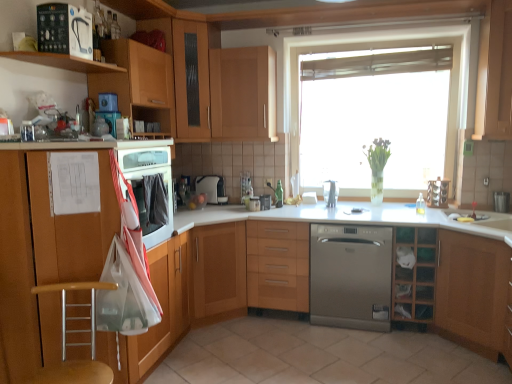
Where is `black plastic water filter at upper left, which ranks as the 2th kitchen appliance in back-to-front order`? This screenshot has height=384, width=512. black plastic water filter at upper left, which ranks as the 2th kitchen appliance in back-to-front order is located at coordinates (64, 30).

This screenshot has height=384, width=512. I want to click on metallic silver toaster at center, which is the second appliance in right-to-left order, so click(254, 204).

You are a GUI agent. You are given a task and a screenshot of the screen. Output one action in this format:
    pyautogui.click(x=<x>, y=<y>)
    Task: Click on the satin nickel faucet at center, the 1th appliance when ordered from right to left
    Image resolution: width=512 pixels, height=384 pixels.
    Given the screenshot: What is the action you would take?
    pyautogui.click(x=330, y=193)

Image resolution: width=512 pixels, height=384 pixels. What do you see at coordinates (414, 274) in the screenshot?
I see `wooden cabinet at lower right, the second shelf positioned from the top` at bounding box center [414, 274].

Measure the distance between light wood/wooden cabinet at center, which is counted as the sixth cabinetry, starting from the left, and camera.

light wood/wooden cabinet at center, which is counted as the sixth cabinetry, starting from the left, and camera are 3.18 meters apart from each other.

Describe the element at coordinates (350, 276) in the screenshot. I see `satin stainless steel dishwasher at lower center` at that location.

Where is `black plastic water filter at upper left, which appears as the 1th kitchen appliance when viewed from the front`? This screenshot has height=384, width=512. black plastic water filter at upper left, which appears as the 1th kitchen appliance when viewed from the front is located at coordinates (64, 30).

Is transparent glass window at center in front of or behind black plastic water filter at upper left, which appears as the 1th kitchen appliance when viewed from the front, in the image?

Clearly, transparent glass window at center is behind black plastic water filter at upper left, which appears as the 1th kitchen appliance when viewed from the front.

Does transparent glass window at center have a larger size compared to black plastic water filter at upper left, which ranks as the 2th kitchen appliance in back-to-front order?

Yes, transparent glass window at center is bigger than black plastic water filter at upper left, which ranks as the 2th kitchen appliance in back-to-front order.

Is transparent glass window at center not inside black plastic water filter at upper left, which appears as the 1th kitchen appliance when viewed from the front?

Yes.

Looking at their sizes, would you say transparent glass window at center is wider or thinner than black plastic water filter at upper left, the 1th kitchen appliance positioned from the left?

Considering their sizes, transparent glass window at center looks broader than black plastic water filter at upper left, the 1th kitchen appliance positioned from the left.

Looking at this image, is wooden cabinet at center, acting as the 4th cabinetry starting from the left, positioned far away from white glossy coffee maker at center, acting as the second kitchen appliance starting from the front?

No, wooden cabinet at center, acting as the 4th cabinetry starting from the left, is not far away from white glossy coffee maker at center, acting as the second kitchen appliance starting from the front.

From a real-world perspective, is wooden cabinet at center, acting as the 4th cabinetry starting from the left, positioned under white glossy coffee maker at center, the first kitchen appliance when ordered from bottom to top, based on gravity?

Indeed, from a real-world perspective, wooden cabinet at center, acting as the 4th cabinetry starting from the left, is positioned beneath white glossy coffee maker at center, the first kitchen appliance when ordered from bottom to top.

From the image's perspective, is wooden cabinet at center, the 5th cabinetry positioned from the right, above white glossy coffee maker at center, which ranks as the first kitchen appliance in back-to-front order?

Actually, wooden cabinet at center, the 5th cabinetry positioned from the right, appears below white glossy coffee maker at center, which ranks as the first kitchen appliance in back-to-front order, in the image.

Does wooden cabinet at center, the 5th cabinetry positioned from the right, have a greater width compared to white glossy coffee maker at center, which ranks as the first kitchen appliance in back-to-front order?

Indeed, wooden cabinet at center, the 5th cabinetry positioned from the right, has a greater width compared to white glossy coffee maker at center, which ranks as the first kitchen appliance in back-to-front order.

From a real-world perspective, is white glossy coffee maker at center, which appears as the 2th kitchen appliance when viewed from the top, beneath wooden cabinet at upper center, positioned as the 5th cabinetry in left-to-right order?

Yes, from a real-world perspective, white glossy coffee maker at center, which appears as the 2th kitchen appliance when viewed from the top, is beneath wooden cabinet at upper center, positioned as the 5th cabinetry in left-to-right order.

Does point (213, 181) appear closer or farther from the camera than point (225, 72)?

Point (213, 181) is farther from the camera than point (225, 72).

Locate an element on the screen. kitchen appliance behind the wooden cabinet at upper center, positioned as the 5th cabinetry in left-to-right order is located at coordinates pyautogui.click(x=211, y=188).

Considering the positions of points (77, 375) and (236, 103), is point (77, 375) closer to camera compared to point (236, 103)?

Yes, point (77, 375) is closer to viewer.

Image resolution: width=512 pixels, height=384 pixels. In order to click on bar stool in front of the wooden cabinet at upper center, arranged as the fourth cabinetry when viewed from the right in this screenshot , I will do `click(75, 343)`.

From the image's perspective, between wooden seat at lower left and wooden cabinet at upper center, positioned as the 5th cabinetry in left-to-right order, which one is located above?

wooden cabinet at upper center, positioned as the 5th cabinetry in left-to-right order.

Considering the sizes of objects matte wood cabinet at left, which is counted as the 8th cabinetry, starting from the right, and wooden seat at lower left in the image provided, who is thinner, matte wood cabinet at left, which is counted as the 8th cabinetry, starting from the right, or wooden seat at lower left?

wooden seat at lower left.

Considering the sizes of matte wood cabinet at left, which appears as the 1th cabinetry when viewed from the left, and wooden seat at lower left in the image, is matte wood cabinet at left, which appears as the 1th cabinetry when viewed from the left, bigger or smaller than wooden seat at lower left?

matte wood cabinet at left, which appears as the 1th cabinetry when viewed from the left, is bigger than wooden seat at lower left.

Consider the image. Can you confirm if matte wood cabinet at left, which is counted as the 8th cabinetry, starting from the right, is shorter than wooden seat at lower left?

Incorrect, the height of matte wood cabinet at left, which is counted as the 8th cabinetry, starting from the right, does not fall short of that of wooden seat at lower left.

Is matte wood cabinet at left, which appears as the 1th cabinetry when viewed from the left, oriented towards wooden seat at lower left?

No, matte wood cabinet at left, which appears as the 1th cabinetry when viewed from the left, is not oriented towards wooden seat at lower left.

Is satin nickel faucet at center, positioned as the second appliance in left-to-right order, in front of or behind satin stainless steel dishwasher at lower center in the image?

In the image, satin nickel faucet at center, positioned as the second appliance in left-to-right order, appears behind satin stainless steel dishwasher at lower center.

Is point (334, 186) farther from viewer compared to point (314, 256)?

Yes, it is behind point (314, 256).

Can you confirm if satin nickel faucet at center, positioned as the second appliance in left-to-right order, is positioned to the right of satin stainless steel dishwasher at lower center?

Incorrect, satin nickel faucet at center, positioned as the second appliance in left-to-right order, is not on the right side of satin stainless steel dishwasher at lower center.

Based on the photo, from a real-world perspective, is satin nickel faucet at center, positioned as the second appliance in left-to-right order, positioned above or below satin stainless steel dishwasher at lower center?

satin nickel faucet at center, positioned as the second appliance in left-to-right order, is situated higher than satin stainless steel dishwasher at lower center in the real world.

Which object is further away from the camera, wooden cabinet at upper right, placed as the first cabinetry when sorted from right to left, or wooden cabinet at lower right, which is the second cabinetry from right to left?

wooden cabinet at upper right, placed as the first cabinetry when sorted from right to left, is behind.

Is wooden cabinet at upper right, the eighth cabinetry positioned from the left, oriented away from wooden cabinet at lower right, which is the second cabinetry from right to left?

wooden cabinet at upper right, the eighth cabinetry positioned from the left, is not turned away from wooden cabinet at lower right, which is the second cabinetry from right to left.

Is point (485, 34) positioned in front of point (449, 249)?

No, it is behind (449, 249).

Does wooden cabinet at upper right, the eighth cabinetry positioned from the left, have a greater height compared to wooden cabinet at lower right, marked as the 7th cabinetry in a left-to-right arrangement?

Correct, wooden cabinet at upper right, the eighth cabinetry positioned from the left, is much taller as wooden cabinet at lower right, marked as the 7th cabinetry in a left-to-right arrangement.

Find the location of `kitchen appliance lying above the transparent glass window at center (from the image's perspective)`. kitchen appliance lying above the transparent glass window at center (from the image's perspective) is located at coordinates click(x=64, y=30).

Where is `kitchen appliance that is the 1st object above the wooden cabinet at center, acting as the 4th cabinetry starting from the left (from a real-world perspective)`? The width and height of the screenshot is (512, 384). kitchen appliance that is the 1st object above the wooden cabinet at center, acting as the 4th cabinetry starting from the left (from a real-world perspective) is located at coordinates (211, 188).

From the image, which object appears to be farther from satin stainless steel dishwasher at lower center, wooden cabinet at upper left, which is counted as the 2th cabinetry, starting from the left, or white glossy coffee maker at center, which appears as the 2th kitchen appliance when viewed from the top?

wooden cabinet at upper left, which is counted as the 2th cabinetry, starting from the left, lies further to satin stainless steel dishwasher at lower center than the other object.

Looking at the image, which one is located further to white glossy coffee maker at center, positioned as the second kitchen appliance in left-to-right order, black plastic water filter at upper left, placed as the second kitchen appliance when sorted from bottom to top, or metallic silver toaster at center, positioned as the 1th appliance in left-to-right order?

Based on the image, black plastic water filter at upper left, placed as the second kitchen appliance when sorted from bottom to top, appears to be further to white glossy coffee maker at center, positioned as the second kitchen appliance in left-to-right order.

Which object lies further to the anchor point wooden cabinet at upper left, placed as the seventh cabinetry when sorted from right to left, satin wood floor at center or transparent glass window at center?

Based on the image, satin wood floor at center appears to be further to wooden cabinet at upper left, placed as the seventh cabinetry when sorted from right to left.

In the scene shown: Considering their positions, is wooden cabinet at upper right, the eighth cabinetry positioned from the left, positioned further to matte wood cabinet at left, which is counted as the 8th cabinetry, starting from the right, than wooden cabinet at upper center, positioned as the third cabinetry in left-to-right order?

The object further to matte wood cabinet at left, which is counted as the 8th cabinetry, starting from the right, is wooden cabinet at upper right, the eighth cabinetry positioned from the left.

From the image, which object appears to be nearer to wooden cabinet at center, the 5th cabinetry positioned from the right, light wood/wooden cabinet at center, which is counted as the sixth cabinetry, starting from the left, or wooden cabinet at upper center, positioned as the 5th cabinetry in left-to-right order?

light wood/wooden cabinet at center, which is counted as the sixth cabinetry, starting from the left, lies closer to wooden cabinet at center, the 5th cabinetry positioned from the right, than the other object.

From the picture: When comparing their distances from satin stainless steel dishwasher at lower center, does wooden cabinet at upper center, positioned as the 5th cabinetry in left-to-right order, or wooden cabinet at center, acting as the 4th cabinetry starting from the left, seem closer?

The object closer to satin stainless steel dishwasher at lower center is wooden cabinet at center, acting as the 4th cabinetry starting from the left.

Based on their spatial positions, is wooden seat at lower left or wooden cabinet at lower right, marked as the 7th cabinetry in a left-to-right arrangement, closer to metallic silver toaster at center, positioned as the 1th appliance in left-to-right order?

wooden cabinet at lower right, marked as the 7th cabinetry in a left-to-right arrangement.

Based on the photo, when comparing their distances from wooden cabinet at upper right, placed as the first cabinetry when sorted from right to left, does wooden cabinet at lower right, marked as the 7th cabinetry in a left-to-right arrangement, or wooden cabinet at center, the 5th cabinetry positioned from the right, seem further?

The object further to wooden cabinet at upper right, placed as the first cabinetry when sorted from right to left, is wooden cabinet at center, the 5th cabinetry positioned from the right.

Find the location of `home appliance between wooden shelf at upper left, the first shelf in the front-to-back sequence, and wooden cabinet at lower right, which is the second cabinetry from right to left, in the horizontal direction`. home appliance between wooden shelf at upper left, the first shelf in the front-to-back sequence, and wooden cabinet at lower right, which is the second cabinetry from right to left, in the horizontal direction is located at coordinates (350, 276).

You are a GUI agent. You are given a task and a screenshot of the screen. Output one action in this format:
    pyautogui.click(x=<x>, y=<y>)
    Task: Click on the cabinetry between wooden shelf at upper left, the second shelf from the right, and matte wood cabinet at left, which is counted as the 8th cabinetry, starting from the right, vertically
    The width and height of the screenshot is (512, 384).
    Given the screenshot: What is the action you would take?
    pyautogui.click(x=138, y=83)

At what (x,y) coordinates should I click in order to perform the action: click on shelf between wooden cabinet at upper left, placed as the seventh cabinetry when sorted from right to left, and wooden cabinet at upper right, placed as the first cabinetry when sorted from right to left, from left to right. Please return your answer as a coordinate pair (x, y). The height and width of the screenshot is (384, 512). Looking at the image, I should click on (414, 274).

Find the location of `kitchen appliance between wooden cabinet at upper left, which is counted as the 2th cabinetry, starting from the left, and satin nickel faucet at center, positioned as the second appliance in left-to-right order, from left to right`. kitchen appliance between wooden cabinet at upper left, which is counted as the 2th cabinetry, starting from the left, and satin nickel faucet at center, positioned as the second appliance in left-to-right order, from left to right is located at coordinates (211, 188).